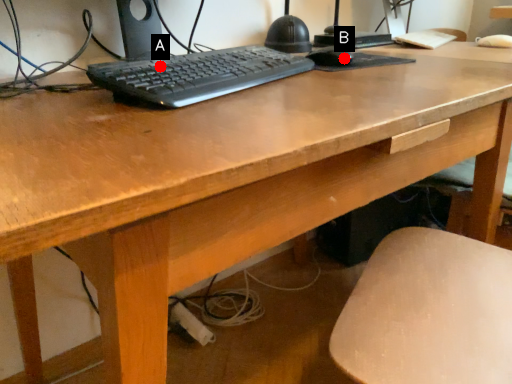
Question: Two points are circled on the image, labeled by A and B beside each circle. Which point is farther to the camera?

Choices:
 (A) A is further
 (B) B is further

Answer: (B)